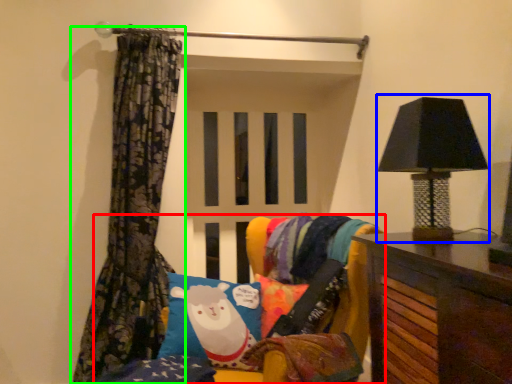
Question: Which object is positioned closest to furniture (highlighted by a red box)? Select from table lamp (highlighted by a blue box) and curtain (highlighted by a green box).

Choices:
 (A) table lamp
 (B) curtain

Answer: (A)